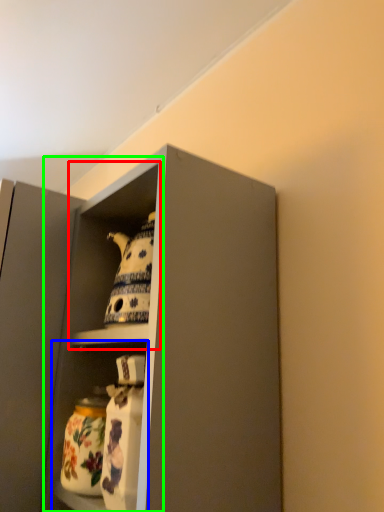
Question: Considering the real-world distances, which object is farthest from cabinet (highlighted by a red box)? shelf (highlighted by a blue box) or cabinet (highlighted by a green box)?

Choices:
 (A) shelf
 (B) cabinet

Answer: (A)